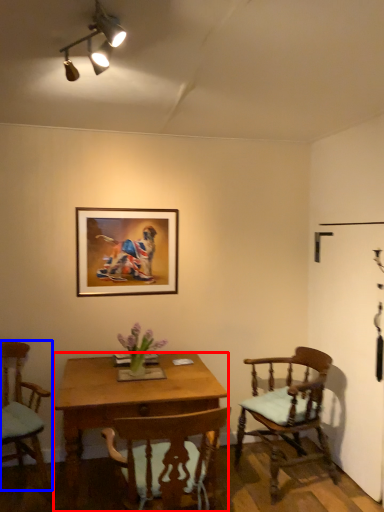
Question: Among these objects, which one is nearest to the camera, desk (highlighted by a red box) or chair (highlighted by a blue box)?

Choices:
 (A) desk
 (B) chair

Answer: (A)